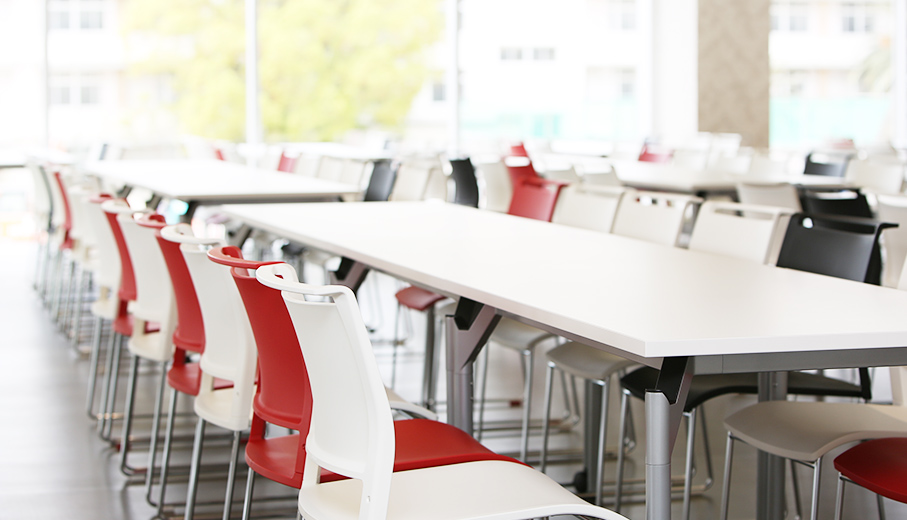
The image size is (907, 520). In order to click on window in this screenshot , I will do `click(177, 80)`, `click(353, 58)`, `click(551, 74)`, `click(807, 69)`.